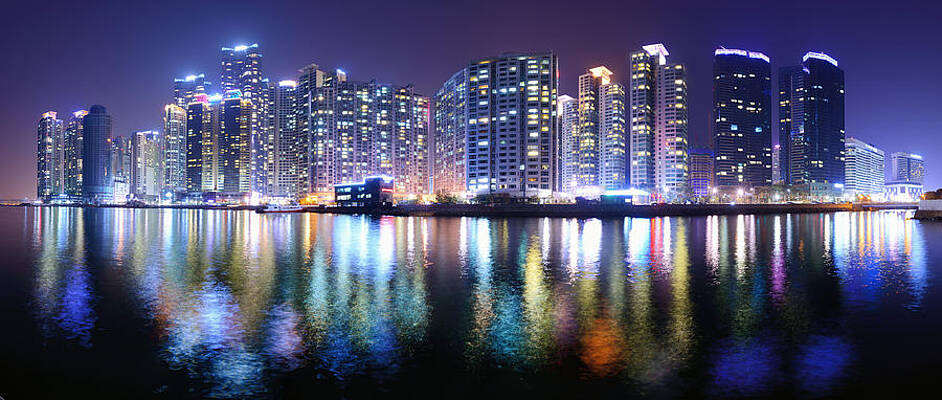
Locate an element on the screen. This screenshot has width=942, height=400. green lights is located at coordinates click(x=513, y=343), click(x=402, y=310), click(x=235, y=370), click(x=180, y=253).